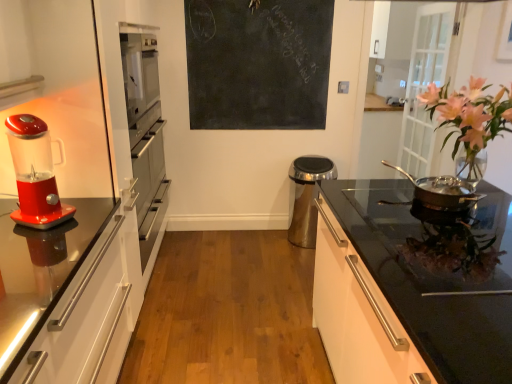
The width and height of the screenshot is (512, 384). I want to click on black chalkboard at upper center, so click(258, 63).

The image size is (512, 384). What do you see at coordinates (258, 63) in the screenshot? I see `black chalkboard at upper center` at bounding box center [258, 63].

In order to face satin silver trash can at center, should I rotate leftwards or rightwards?

It's best to rotate right around 7.653 degrees.

Locate an element on the screen. shiny silver pan at right is located at coordinates (442, 191).

Where is `shiny plastic blender at left`? This screenshot has width=512, height=384. shiny plastic blender at left is located at coordinates (35, 174).

Which is more to the left, black glossy cabinet at right or satin silver trash can at center?

From the viewer's perspective, satin silver trash can at center appears more on the left side.

Is black glossy cabinet at right looking in the opposite direction of satin silver trash can at center?

black glossy cabinet at right is not turned away from satin silver trash can at center.

Is point (386, 312) closer to viewer compared to point (327, 166)?

Yes, point (386, 312) is closer to viewer.

In the image, there is a black chalkboard at upper center. Identify the location of home appliance below it (from a real-world perspective). Image resolution: width=512 pixels, height=384 pixels. (35, 174).

Which of these two, black chalkboard at upper center or shiny plastic blender at left, stands shorter?

shiny plastic blender at left.

Between black chalkboard at upper center and shiny plastic blender at left, which one is positioned behind?

black chalkboard at upper center is further from the camera.

How different are the orientations of black chalkboard at upper center and shiny plastic blender at left in degrees?

The angular difference between black chalkboard at upper center and shiny plastic blender at left is 64.3 degrees.

Is shiny silver pan at right far from shiny plastic blender at left?

Absolutely, shiny silver pan at right is distant from shiny plastic blender at left.

Is shiny silver pan at right smaller than shiny plastic blender at left?

Yes, shiny silver pan at right is smaller than shiny plastic blender at left.

Can you confirm if shiny silver pan at right is thinner than shiny plastic blender at left?

No.

In the scene shown: From the image's perspective, is shiny silver pan at right located above or below shiny plastic blender at left?

Based on their image positions, shiny silver pan at right is located beneath shiny plastic blender at left.

Who is shorter, shiny silver pan at right or pink glass vase at right?

shiny silver pan at right.

From the image's perspective, between shiny silver pan at right and pink glass vase at right, which one is located above?

From the image's view, pink glass vase at right is above.

Which object is positioned more to the left, shiny silver pan at right or pink glass vase at right?

Positioned to the left is shiny silver pan at right.

Considering the sizes of pink glass vase at right and black glossy cabinet at right in the image, is pink glass vase at right taller or shorter than black glossy cabinet at right?

In the image, pink glass vase at right appears to be shorter than black glossy cabinet at right.

Is pink glass vase at right not near black glossy cabinet at right?

That's not correct — pink glass vase at right is a little close to black glossy cabinet at right.

Is pink glass vase at right oriented towards black glossy cabinet at right?

No, pink glass vase at right does not turn towards black glossy cabinet at right.

Locate an element on the screen. cabinetry on the left of pink glass vase at right is located at coordinates (358, 315).

Considering the points (327, 261) and (195, 111), which point is behind, point (327, 261) or point (195, 111)?

The point (195, 111) is behind.

Is black glossy cabinet at right in front of or behind black chalkboard at upper center in the image?

In the image, black glossy cabinet at right appears in front of black chalkboard at upper center.

The width and height of the screenshot is (512, 384). In order to click on bulletin board that is on the left side of black glossy cabinet at right in this screenshot , I will do `click(258, 63)`.

From a real-world perspective, is satin silver trash can at center positioned above or below black glossy cabinet at right?

From a real-world perspective, satin silver trash can at center is physically below black glossy cabinet at right.

Is satin silver trash can at center positioned with its back to black glossy cabinet at right?

No, black glossy cabinet at right is not at the back of satin silver trash can at center.

Does satin silver trash can at center have a lesser height compared to black glossy cabinet at right?

Correct, satin silver trash can at center is not as tall as black glossy cabinet at right.

Looking at this image, is satin silver trash can at center to the left of black glossy cabinet at right from the viewer's perspective?

Correct, you'll find satin silver trash can at center to the left of black glossy cabinet at right.

In order to click on appliance below the black glossy cabinet at right (from a real-world perspective) in this screenshot , I will do `click(307, 197)`.

You are a GUI agent. You are given a task and a screenshot of the screen. Output one action in this format:
    pyautogui.click(x=<x>, y=<y>)
    Task: Click on the bulletin board lying on the right of shiny plastic blender at left
    This screenshot has height=384, width=512.
    Given the screenshot: What is the action you would take?
    pyautogui.click(x=258, y=63)

Looking at the image, which one is located closer to pink glass vase at right, black chalkboard at upper center or shiny plastic blender at left?

Based on the image, black chalkboard at upper center appears to be nearer to pink glass vase at right.

Based on their spatial positions, is pink glass vase at right or satin silver trash can at center further from black chalkboard at upper center?

pink glass vase at right lies further to black chalkboard at upper center than the other object.

Based on their spatial positions, is pink glass vase at right or shiny plastic blender at left further from satin silver trash can at center?

Among the two, shiny plastic blender at left is located further to satin silver trash can at center.

Based on their spatial positions, is shiny silver pan at right or black glossy cabinet at right further from satin silver trash can at center?

black glossy cabinet at right is positioned further to the anchor satin silver trash can at center.

Estimate the real-world distances between objects in this image. Which object is further from pink glass vase at right, shiny plastic blender at left or shiny silver pan at right?

→ shiny plastic blender at left is positioned further to the anchor pink glass vase at right.

Estimate the real-world distances between objects in this image. Which object is further from black chalkboard at upper center, black glossy cabinet at right or pink glass vase at right?

black glossy cabinet at right lies further to black chalkboard at upper center than the other object.

Based on their spatial positions, is shiny plastic blender at left or pink glass vase at right further from black glossy cabinet at right?

Among the two, shiny plastic blender at left is located further to black glossy cabinet at right.

Which object lies further to the anchor point satin silver trash can at center, black glossy cabinet at right or shiny silver pan at right?

The object further to satin silver trash can at center is black glossy cabinet at right.

You are a GUI agent. You are given a task and a screenshot of the screen. Output one action in this format:
    pyautogui.click(x=<x>, y=<y>)
    Task: Click on the kitchen appliance between shiny plastic blender at left and pink glass vase at right from left to right
    This screenshot has height=384, width=512.
    Given the screenshot: What is the action you would take?
    pyautogui.click(x=442, y=191)

You are a GUI agent. You are given a task and a screenshot of the screen. Output one action in this format:
    pyautogui.click(x=<x>, y=<y>)
    Task: Click on the floral arrangement positioned between black glossy cabinet at right and black chalkboard at upper center from near to far
    This screenshot has height=384, width=512.
    Given the screenshot: What is the action you would take?
    pyautogui.click(x=469, y=117)

Where is `kitchen appliance between black glossy cabinet at right and pink glass vase at right in the front-back direction`? kitchen appliance between black glossy cabinet at right and pink glass vase at right in the front-back direction is located at coordinates (442, 191).

The image size is (512, 384). Find the location of `kitchen appliance located between black glossy cabinet at right and black chalkboard at upper center in the depth direction`. kitchen appliance located between black glossy cabinet at right and black chalkboard at upper center in the depth direction is located at coordinates (442, 191).